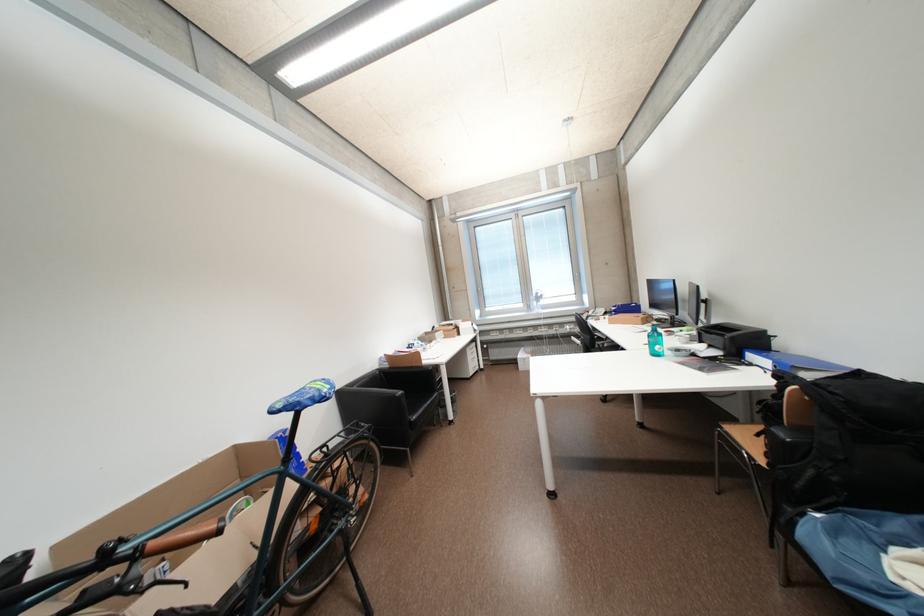
The width and height of the screenshot is (924, 616). What do you see at coordinates (409, 378) in the screenshot?
I see `a black chair armrest` at bounding box center [409, 378].